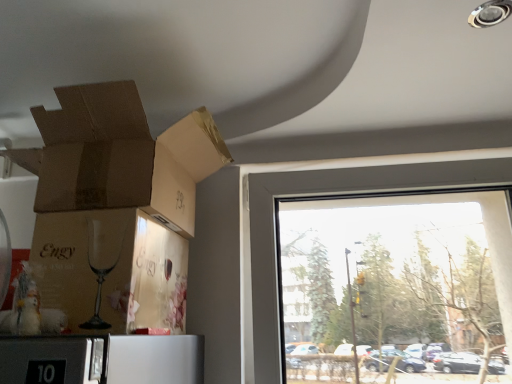
Question: Is transparent glass window at right spatially inside brown cardboard box at upper left, which is the second cardboard box from bottom to top, or outside of it?

Choices:
 (A) outside
 (B) inside

Answer: (A)

Question: Would you say transparent glass window at right is to the left or to the right of brown cardboard box at upper left, marked as the first cardboard box in a top-to-bottom arrangement, in the picture?

Choices:
 (A) left
 (B) right

Answer: (B)

Question: Estimate the real-world distances between objects in this image. Which object is closer to the matte brown cardboard at lower left, acting as the 2th cardboard box starting from the top?

Choices:
 (A) transparent glass window at right
 (B) brown cardboard box at upper left, which is the second cardboard box from bottom to top

Answer: (B)

Question: Which object is positioned closest to the matte brown cardboard at lower left, acting as the 2th cardboard box starting from the top?

Choices:
 (A) brown cardboard box at upper left, marked as the first cardboard box in a top-to-bottom arrangement
 (B) transparent glass window at right

Answer: (A)